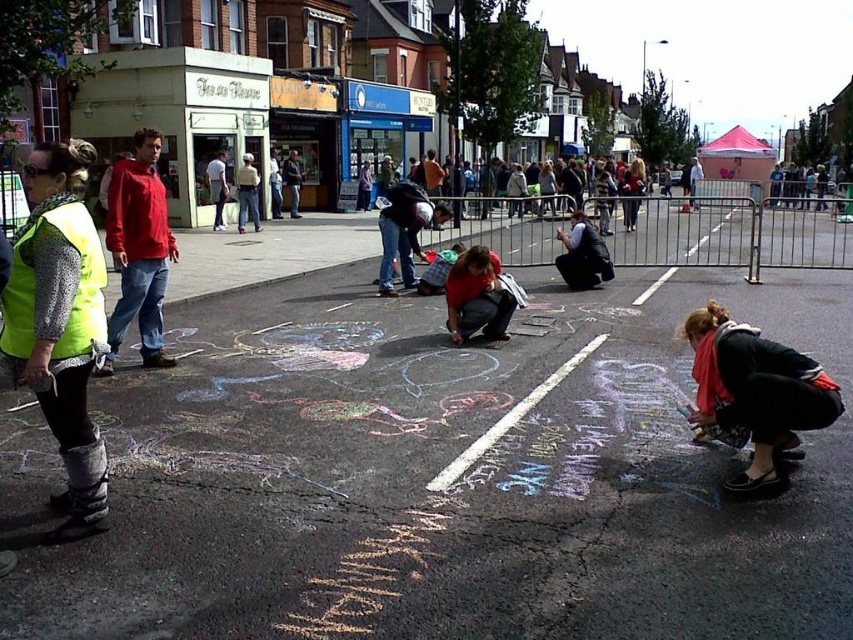
You are a pedestrian who wants to cross the street where the chalk art is happening. There is a person in a neon yellow reflective vest at left and a person in a matte black jacket at center. The road is 30 feet wide. Can you safely cross the road between these two people without stepping into the traffic lane?

The neon yellow reflective vest at left and matte black jacket at center are 27.39 feet apart. Since the road is 30 feet wide, the gap between them is narrower than the road width, so there might still be space to cross safely between them. However, it depends on their exact positions relative to the traffic lanes. The question doesn not provide information about traffic lanes, so the safest assumption is to check for traffic before crossing.

You are a pedestrian standing at point (61, 324) in the street scene. You notice a neon yellow reflective vest at left. What is the nearest object to you?

The nearest object to you at point (61, 324) is the neon yellow reflective vest at left, as it is located at that exact coordinate.